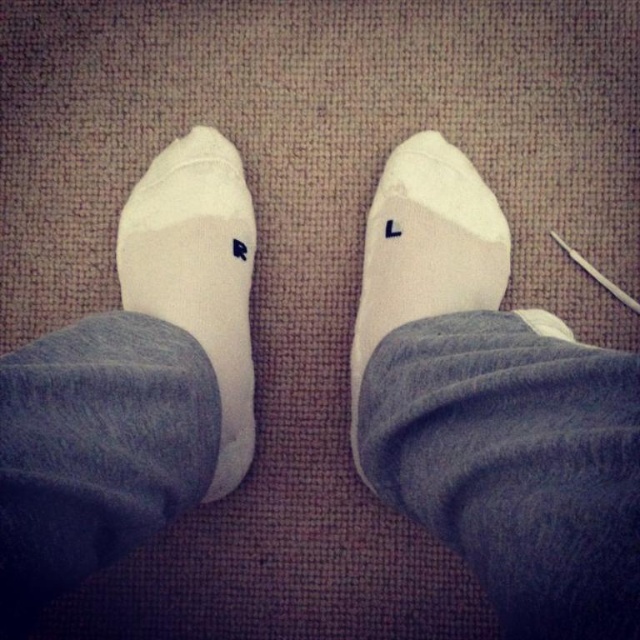
You are standing in front of the carpet and see two points marked on it. The first point is at coordinates point [216,314] and the second point is at point [438,296]. Which point is closer to you?

Point [438,296] is closer to you because it is in front of point [216,314].

In the scene shown: You are standing in a room with a textured beige carpet. You notice a pair of white socks with letters on them. The socks are placed at point (198, 273). Which sock has the letter L?

The white matte socks at left at point (198, 273) has the letter L.

You are trying to locate the white matte socks at left in the image. According to the coordinates provided, where exactly would you find them?

The white matte socks at left are located at point (198, 273).